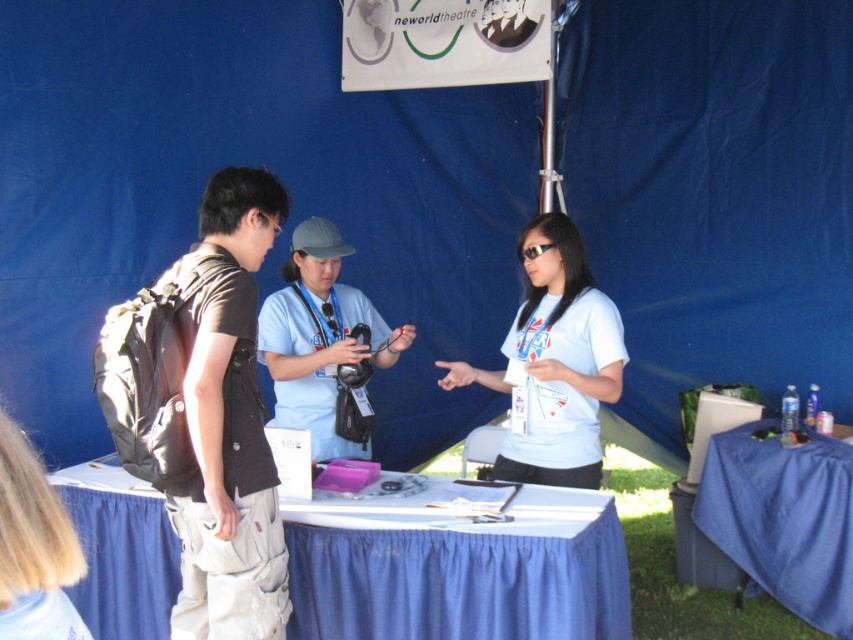
You need to place a large box that requires more space than the blue fabric table at center currently takes. Can the dark brown fabric backpack at left be moved to accommodate this?

The blue fabric table at center occupies less space than the dark brown fabric backpack at left, so moving the dark brown fabric backpack at left would free up more space, allowing room for the large box.

You are at the event and need to find the item located at point (598,381). Which direction should you move relative to point (827,557) to reach it?

You should move forward from point (827,557) to reach point (598,381) since it is in front of it.